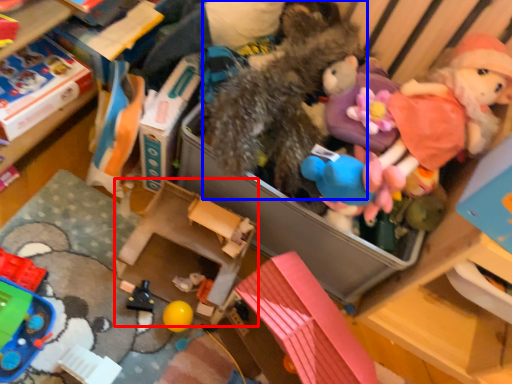
Question: Which of the following is the closest to the observer, storage box (highlighted by a red box) or toy (highlighted by a blue box)?

Choices:
 (A) storage box
 (B) toy

Answer: (B)